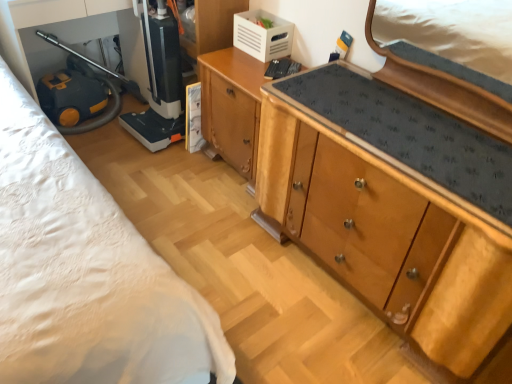
You are a GUI agent. You are given a task and a screenshot of the screen. Output one action in this format:
    pyautogui.click(x=<x>, y=<y>)
    Task: Click on the vacant space that is to the left of wooden cabinet at center, placed as the 2th cabinetry when sorted from left to right
    
    Given the screenshot: What is the action you would take?
    pyautogui.click(x=216, y=253)